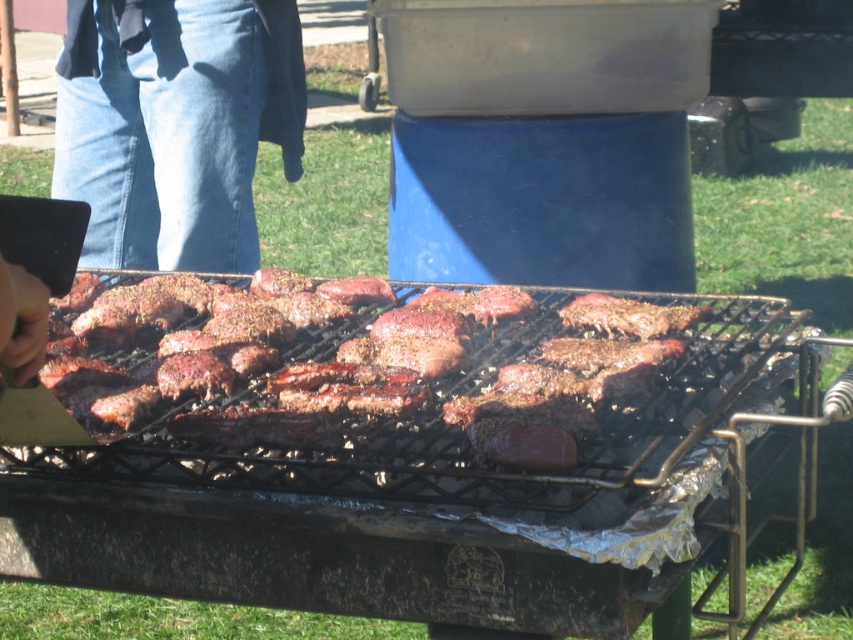
You are at a barbecue and want to know which item is bigger between the grilled meat at center and the denim jeans at left. Can you tell me?

The grilled meat at center is larger in size than denim jeans at left, so the grilled meat at center is bigger.